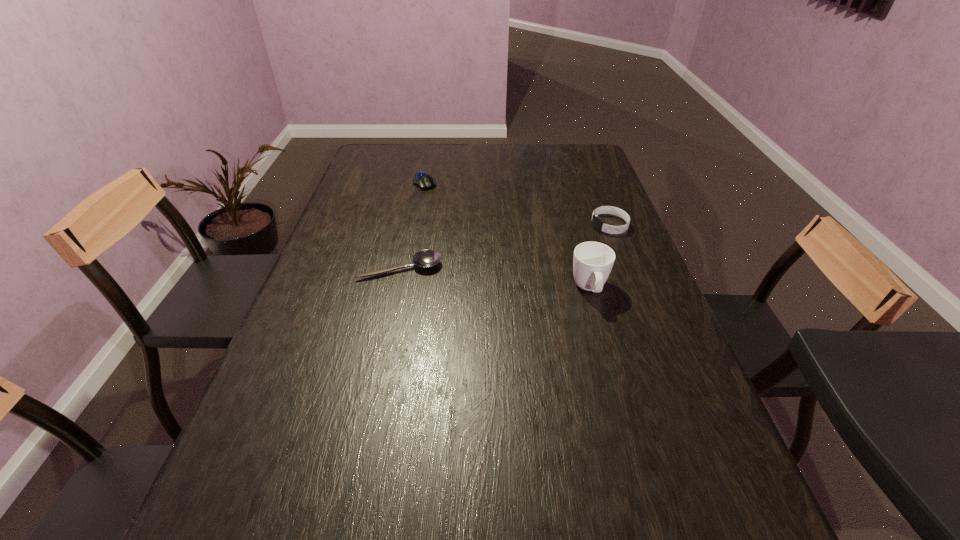
Where is `free space on the desktop that is between the shortest object and the cup and is positioned on the button side of the farthest object`? free space on the desktop that is between the shortest object and the cup and is positioned on the button side of the farthest object is located at coordinates (486, 278).

Identify the location of vacant space on the desktop that is between the ladle and the cup and is positioned on the outer surface of the third shortest object. (467, 275).